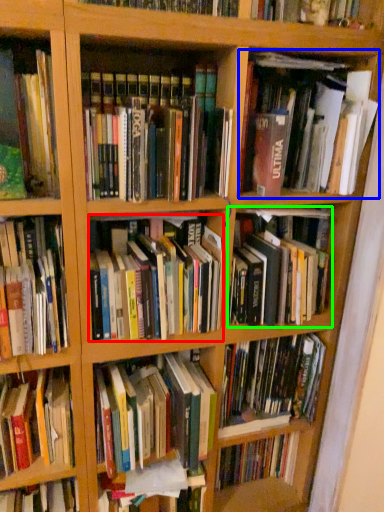
Question: Based on their relative distances, which object is nearer to book (highlighted by a red box)? Choose from book (highlighted by a blue box) and book (highlighted by a green box).

Choices:
 (A) book
 (B) book

Answer: (B)